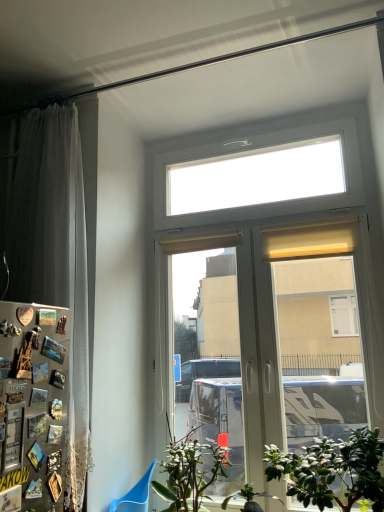
Question: Is white sheer curtain at left placed right next to metallic silver fridge at left?

Choices:
 (A) yes
 (B) no

Answer: (B)

Question: Is white sheer curtain at left at the left side of metallic silver fridge at left?

Choices:
 (A) no
 (B) yes

Answer: (B)

Question: From the image's perspective, is white sheer curtain at left over metallic silver fridge at left?

Choices:
 (A) yes
 (B) no

Answer: (A)

Question: Considering the relative sizes of white sheer curtain at left and metallic silver fridge at left in the image provided, is white sheer curtain at left bigger than metallic silver fridge at left?

Choices:
 (A) no
 (B) yes

Answer: (B)

Question: Is white sheer curtain at left far away from metallic silver fridge at left?

Choices:
 (A) no
 (B) yes

Answer: (A)

Question: Can you confirm if white sheer curtain at left is taller than metallic silver fridge at left?

Choices:
 (A) yes
 (B) no

Answer: (A)

Question: Is green matte plant at lower center, the third houseplant positioned from the right, at the back of green leafy plant at lower right, which is the third houseplant in left-to-right order?

Choices:
 (A) yes
 (B) no

Answer: (B)

Question: From the image's perspective, would you say green leafy plant at lower right, the 1th houseplant in the right-to-left sequence, is shown under green matte plant at lower center, which is the 1th houseplant from left to right?

Choices:
 (A) yes
 (B) no

Answer: (B)

Question: Is green leafy plant at lower right, the 1th houseplant in the right-to-left sequence, in contact with green matte plant at lower center, which is the 1th houseplant from left to right?

Choices:
 (A) yes
 (B) no

Answer: (B)

Question: Is green leafy plant at lower right, the 1th houseplant in the right-to-left sequence, shorter than green matte plant at lower center, which is the 1th houseplant from left to right?

Choices:
 (A) yes
 (B) no

Answer: (A)

Question: Can you confirm if green leafy plant at lower right, which is the third houseplant in left-to-right order, is bigger than green matte plant at lower center, the third houseplant positioned from the right?

Choices:
 (A) yes
 (B) no

Answer: (B)

Question: Could you tell me if green leafy plant at lower right, which is the third houseplant in left-to-right order, is turned towards green matte plant at lower center, the third houseplant positioned from the right?

Choices:
 (A) yes
 (B) no

Answer: (B)

Question: Can you confirm if white plastic window at center is smaller than metallic silver fridge at left?

Choices:
 (A) yes
 (B) no

Answer: (B)